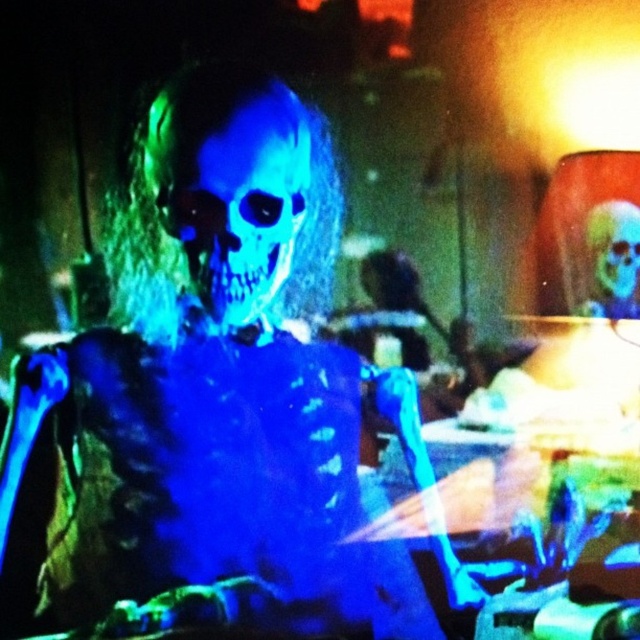
Who is taller, blue matte skull at center or translucent blue skull at center?

Standing taller between the two is blue matte skull at center.

Who is more forward, (273, 129) or (608, 307)?

Point (273, 129) is in front.

Is point (289, 243) positioned behind point (602, 296)?

No, it is not.

You are a GUI agent. You are given a task and a screenshot of the screen. Output one action in this format:
    pyautogui.click(x=<x>, y=<y>)
    Task: Click on the blue matte skull at center
    This screenshot has height=640, width=640.
    Given the screenshot: What is the action you would take?
    pyautogui.click(x=244, y=205)

Looking at this image, who is positioned more to the left, blue matte skull at center or blue translucent skull at upper right?

blue matte skull at center

Is blue matte skull at center closer to the viewer compared to blue translucent skull at upper right?

Yes, blue matte skull at center is in front of blue translucent skull at upper right.

Between point (275, 184) and point (621, 241), which one is positioned in front?

Positioned in front is point (275, 184).

The height and width of the screenshot is (640, 640). I want to click on blue matte skull at center, so click(x=244, y=205).

Does blue translucent skeleton at center have a smaller size compared to blue translucent skull at upper right?

No.

Does blue translucent skeleton at center have a larger size compared to blue translucent skull at upper right?

Indeed, blue translucent skeleton at center has a larger size compared to blue translucent skull at upper right.

You are a GUI agent. You are given a task and a screenshot of the screen. Output one action in this format:
    pyautogui.click(x=<x>, y=<y>)
    Task: Click on the blue translucent skeleton at center
    The image size is (640, 640).
    Given the screenshot: What is the action you would take?
    pyautogui.click(x=224, y=387)